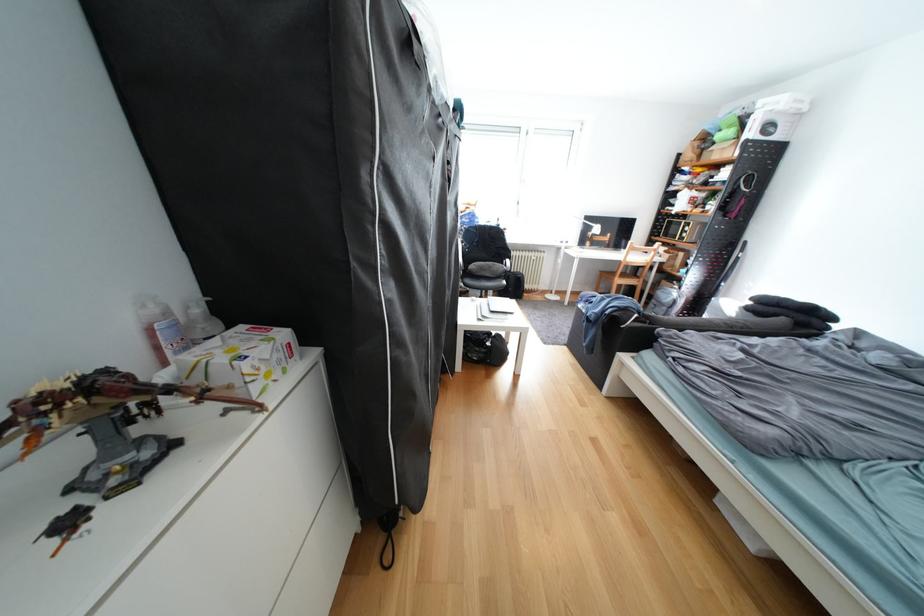
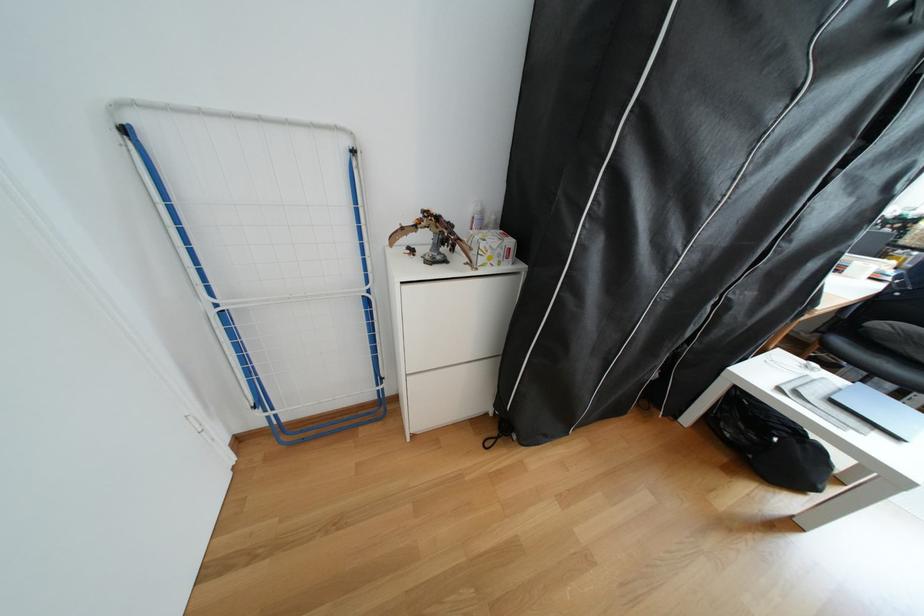
Locate, in the second image, the point that corresponds to point (525, 315) in the first image.

(908, 439)